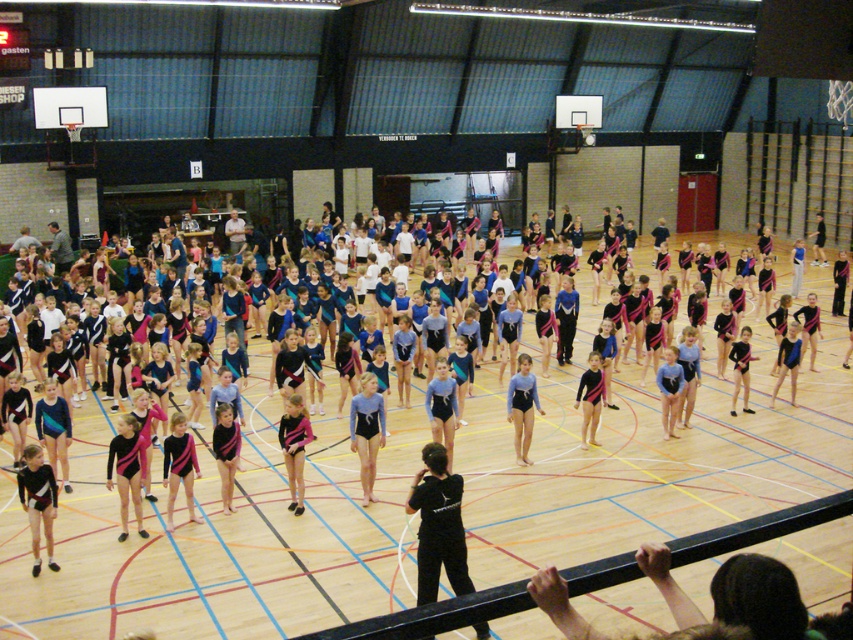
You are standing in the gymnasium and want to reach a specific point marked at coordinates point (375,388). If you can walk straight ahead, will you arrive at that point within 30 seconds? Assume your walking speed is 3 feet per second.

The distance of point (375,388) from viewer is 31.68 feet. At a walking speed of 3 feet per second, it would take approximately 10.56 seconds to reach the point. Since 10.56 seconds is less than 30 seconds, you will arrive at the point within the time limit.

You are a photographer standing at the entrance of the gymnasium. You need to take a photo of the black matte black uniform at center. Where should you position yourself to ensure the point represented by point [438,525] is centered in your camera frame?

To center the point [438,525] in your camera frame, position yourself directly in front of the black matte black uniform at center, aligning the camera so the coordinates correspond to the center of the viewfinder.